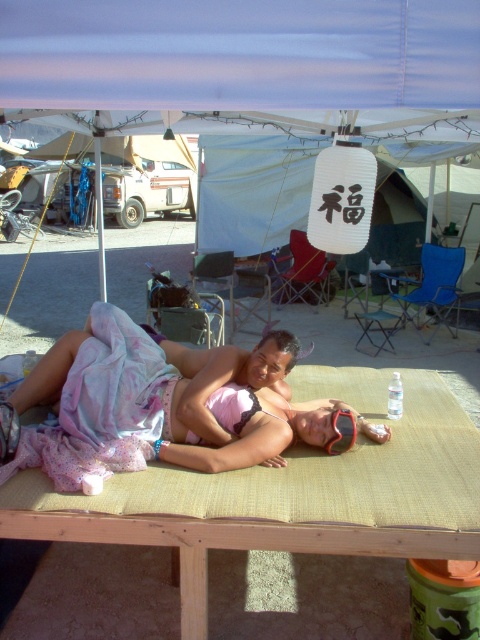
Question: Is black rubber goggles at center wider than transparent plastic goggles at upper center?

Choices:
 (A) no
 (B) yes

Answer: (B)

Question: Which object is farther from the camera taking this photo?

Choices:
 (A) white fabric canopy at upper center
 (B) yellow woven picnic table at center
 (C) clear plastic bottle at center

Answer: (C)

Question: Estimate the real-world distances between objects in this image. Which object is farther from the black rubber goggles at center?

Choices:
 (A) transparent plastic bottle at center
 (B) pink fabric bikini at center
 (C) white fabric canopy at upper center
 (D) clear plastic bottle at center

Answer: (D)

Question: Which point is closer to the camera?

Choices:
 (A) click(x=328, y=451)
 (B) click(x=124, y=513)

Answer: (B)

Question: Is pink fabric bikini at center below clear plastic bottle at center?

Choices:
 (A) no
 (B) yes

Answer: (B)

Question: Is pink fabric bikini at center in front of transparent plastic bottle at center?

Choices:
 (A) yes
 (B) no

Answer: (A)